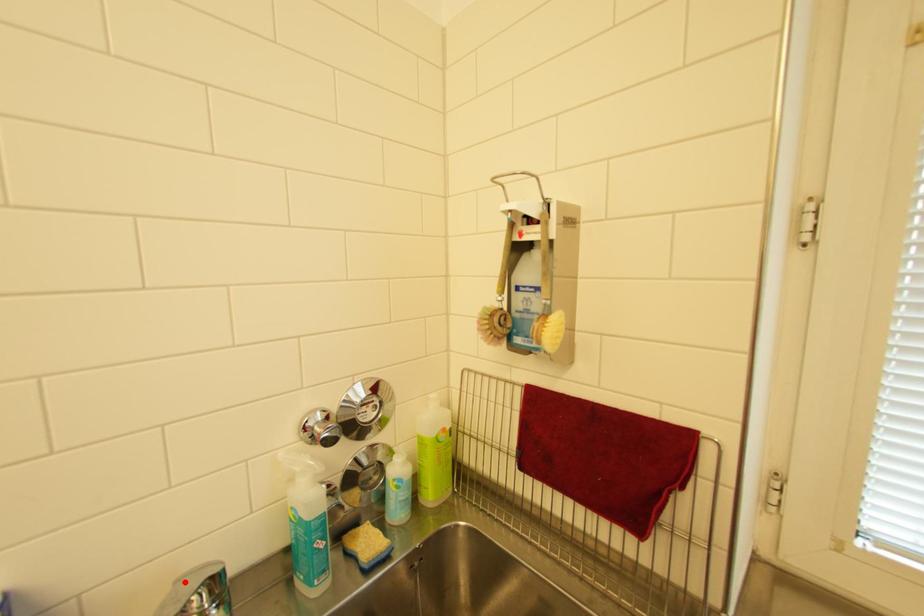
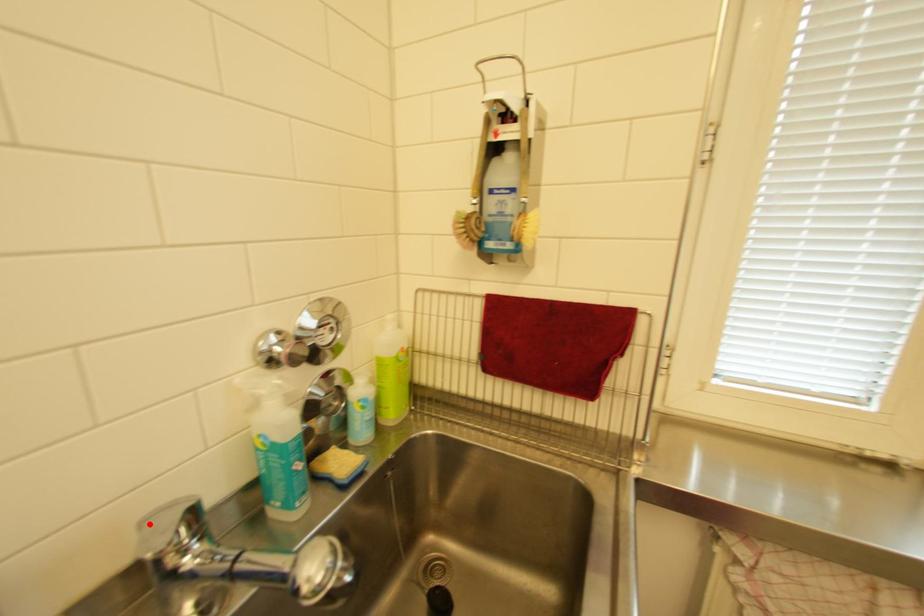
Looking at this image, I am providing you with two images of the same scene from different viewpoints. A red point is marked on the first image and another point is marked on the second image. Is the red point in image1 aligned with the point shown in image2?

Yes